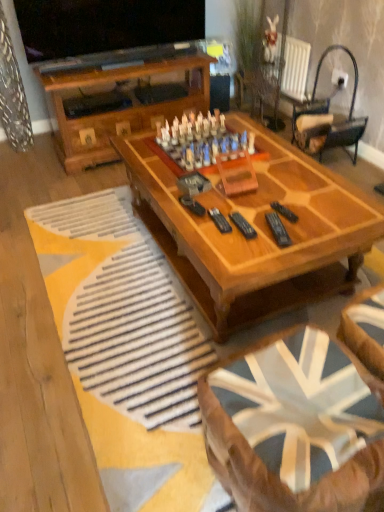
This screenshot has width=384, height=512. What are the coordinates of `free area in between black plastic remote at center, which is the 2th remote in left-to-right order, and black plastic remote at center, marked as the 1th remote in a left-to-right arrangement` in the screenshot? It's located at (254, 226).